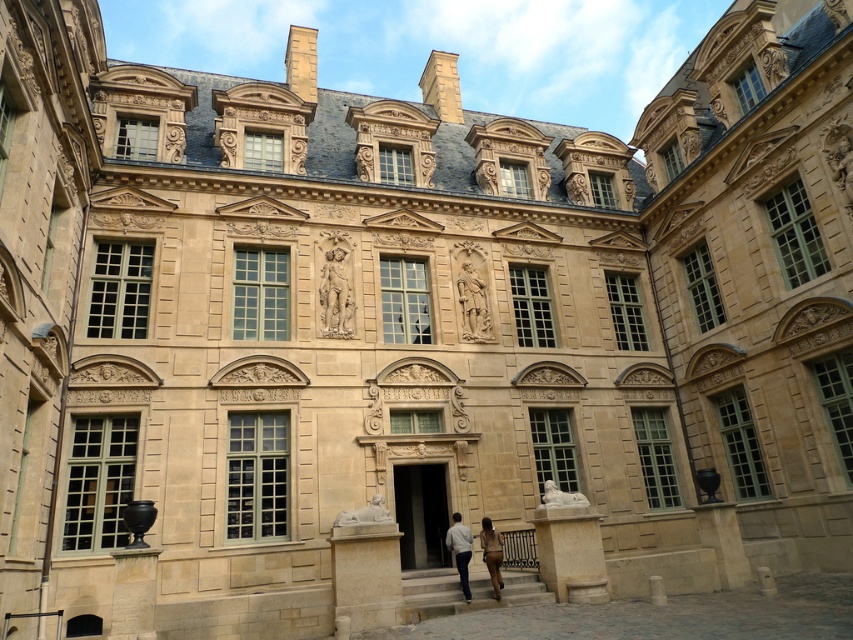
Question: Can you confirm if white cotton shirt at center is wider than brown leather pants at center?

Choices:
 (A) yes
 (B) no

Answer: (B)

Question: Does white cotton shirt at center appear on the right side of brown leather pants at center?

Choices:
 (A) yes
 (B) no

Answer: (B)

Question: Which point is farther to the camera?

Choices:
 (A) white cotton shirt at center
 (B) brown leather pants at center

Answer: (A)

Question: In this image, where is white cotton shirt at center located relative to brown leather pants at center?

Choices:
 (A) right
 (B) left

Answer: (B)

Question: Which object is farther from the camera taking this photo?

Choices:
 (A) white cotton shirt at center
 (B) brown leather pants at center

Answer: (A)